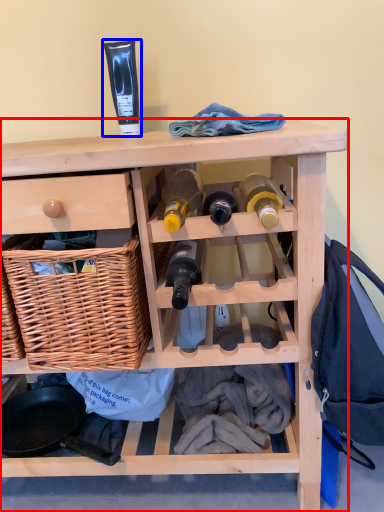
Question: Which point is closer to the camera, furniture (highlighted by a red box) or toiletry (highlighted by a blue box)?

Choices:
 (A) furniture
 (B) toiletry

Answer: (A)